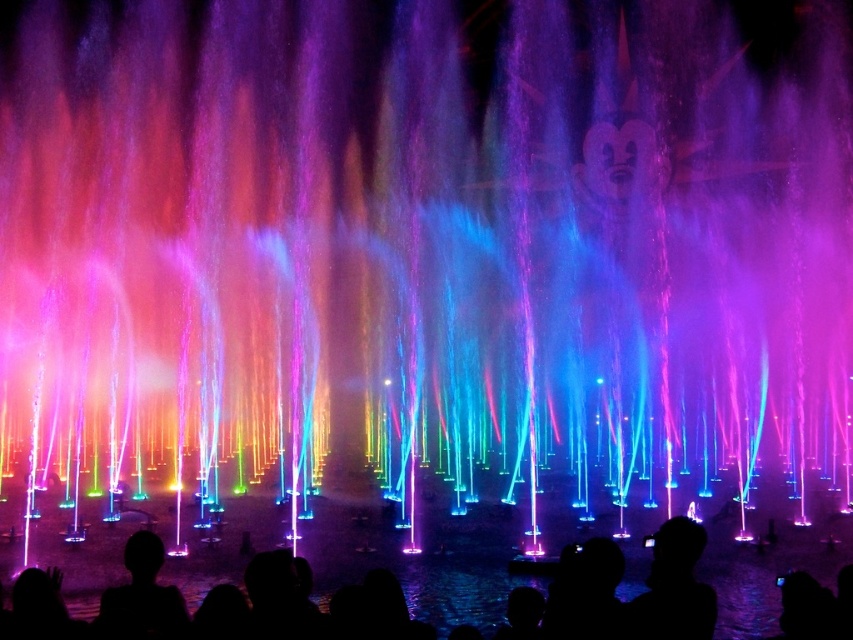
You are standing at the front of the fountain and see two silhouette heads, the silhouette head at lower center and the silhouette head at lower left. Which one is closer to you?

The silhouette head at lower center is closer to you because the silhouette head at lower left is behind it.

You are a tour guide leading a group to the silhouette head at center. You see the silhouette head at lower center in front of it. Can your group walk between them? Please explain.

The silhouette head at lower center and the silhouette head at center are 14.12 meters apart from each other. Since the distance between them is quite large, your group can easily walk between them.